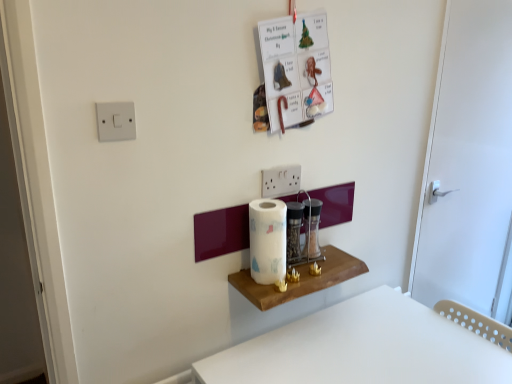
Where is `vacant space to the right of white glossy paper towel at center`? The width and height of the screenshot is (512, 384). vacant space to the right of white glossy paper towel at center is located at coordinates point(315,268).